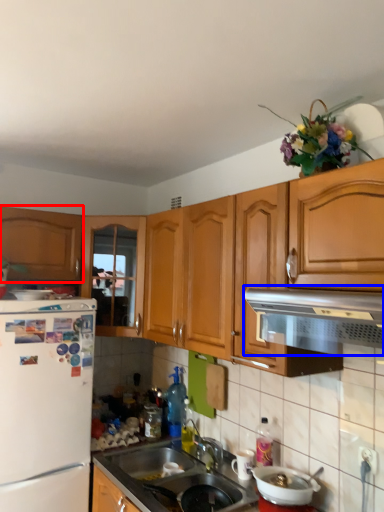
Question: Among these objects, which one is farthest to the camera, cabinetry (highlighted by a red box) or vent (highlighted by a blue box)?

Choices:
 (A) cabinetry
 (B) vent

Answer: (A)